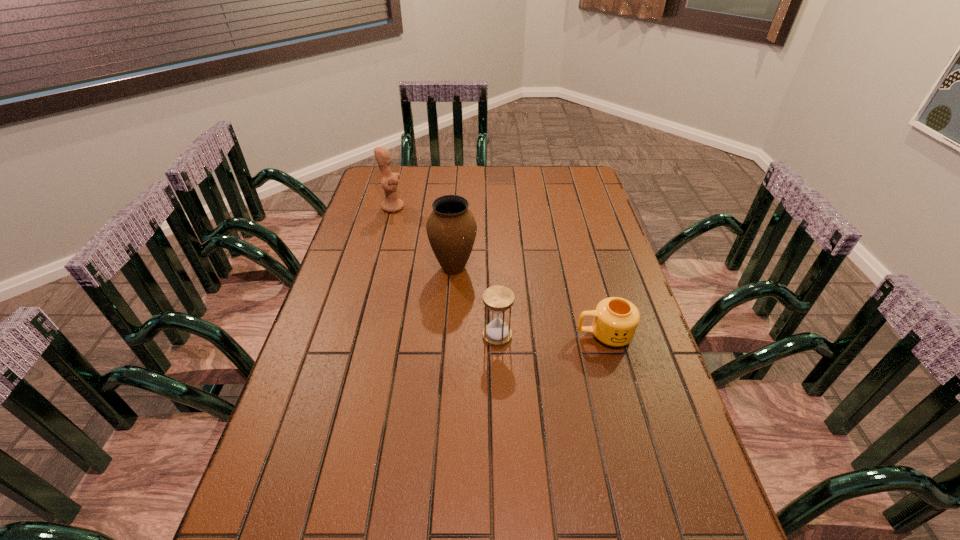
Locate an element on the screen. This screenshot has height=540, width=960. the leftmost object is located at coordinates tap(389, 181).

Where is `figurine`? Image resolution: width=960 pixels, height=540 pixels. figurine is located at coordinates (389, 181).

This screenshot has height=540, width=960. Find the location of `the second object from left to right`. the second object from left to right is located at coordinates (451, 227).

Find the location of a particular element. Image resolution: width=960 pixels, height=540 pixels. urn is located at coordinates (451, 227).

Locate an element on the screen. This screenshot has width=960, height=540. the third tallest object is located at coordinates (498, 299).

Where is `the third object from left to right`? This screenshot has height=540, width=960. the third object from left to right is located at coordinates click(x=498, y=299).

You are a GUI agent. You are given a task and a screenshot of the screen. Output one action in this format:
    pyautogui.click(x=<x>, y=<y>)
    Task: Click on the mug
    
    Given the screenshot: What is the action you would take?
    pyautogui.click(x=615, y=322)

Identify the location of the rightmost object. (615, 322).

Locate an element on the screen. This screenshot has width=960, height=540. free space located 0.360m on the front-facing side of the figurine is located at coordinates (499, 207).

Where is `free space located 0.270m on the left of the urn`? free space located 0.270m on the left of the urn is located at coordinates (346, 268).